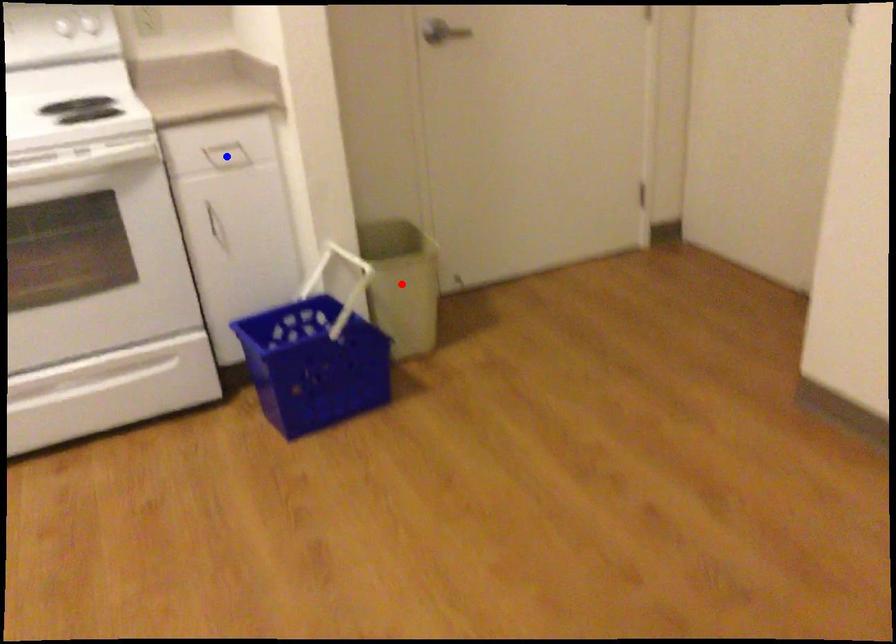
Question: In the image, two points are highlighted. Which point is nearer to the camera? Reply with the corresponding letter.

Choices:
 (A) blue point
 (B) red point

Answer: (A)